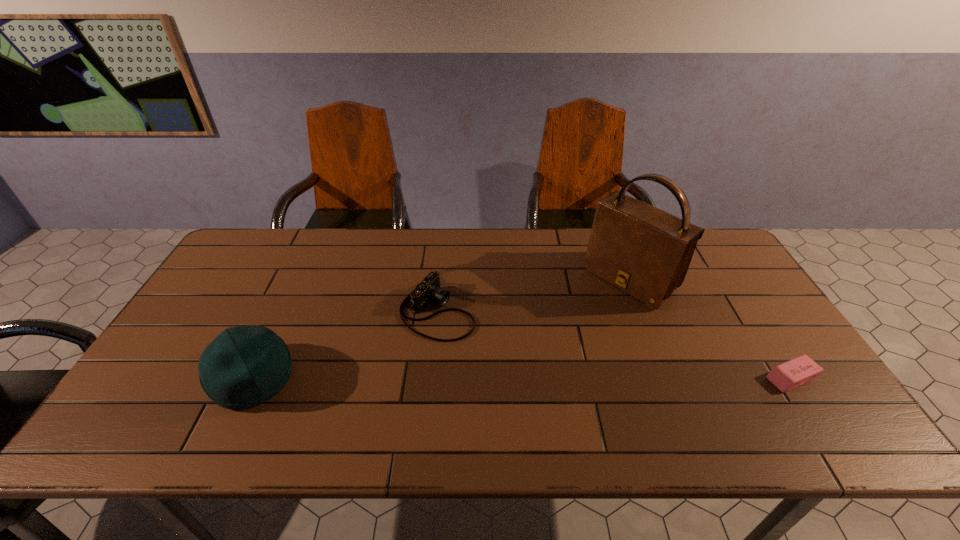
This screenshot has width=960, height=540. Identify the location of vacant space on the desktop that is between the third shortest object and the shortest object and is positioned on the front-facing side of the second object from left to right. (589, 378).

The image size is (960, 540). I want to click on free space on the desktop that is between the leftmost object and the rightmost object and is positioned on the front flap of the shoulder bag, so click(x=508, y=378).